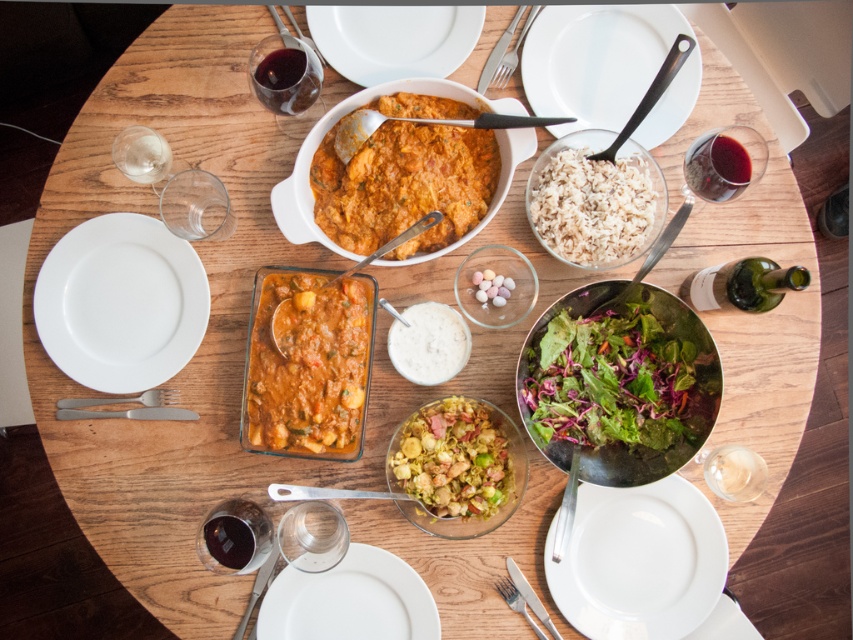
Question: Estimate the real-world distances between objects in this image. Which object is closer to the silvermetallicfork at left?

Choices:
 (A) white matte rice at center right
 (B) silver metallic knife at lower center
 (C) orange creamy curry at center
 (D) translucent glass wine at lower left

Answer: (D)

Question: Does green leafy salad at lower right have a greater width compared to white matte plate at lower center?

Choices:
 (A) yes
 (B) no

Answer: (B)

Question: Which object is positioned farthest from the translucent glass wine at upper left?

Choices:
 (A) brushed metal tongs at upper center
 (B) dark red glass at lower left

Answer: (B)

Question: Does rich tomato sauce at center appear over white glossy plate at upper center?

Choices:
 (A) yes
 (B) no

Answer: (B)

Question: Is shiny glass bowl at center closer to the viewer compared to silver metallic knife at lower center?

Choices:
 (A) yes
 (B) no

Answer: (A)

Question: Which object appears closest to the camera in this image?

Choices:
 (A) silver metallic fork at upper center
 (B) translucent glass wine at upper left
 (C) silver metallic knife at lower center
 (D) silver metallic fork at lower left

Answer: (B)